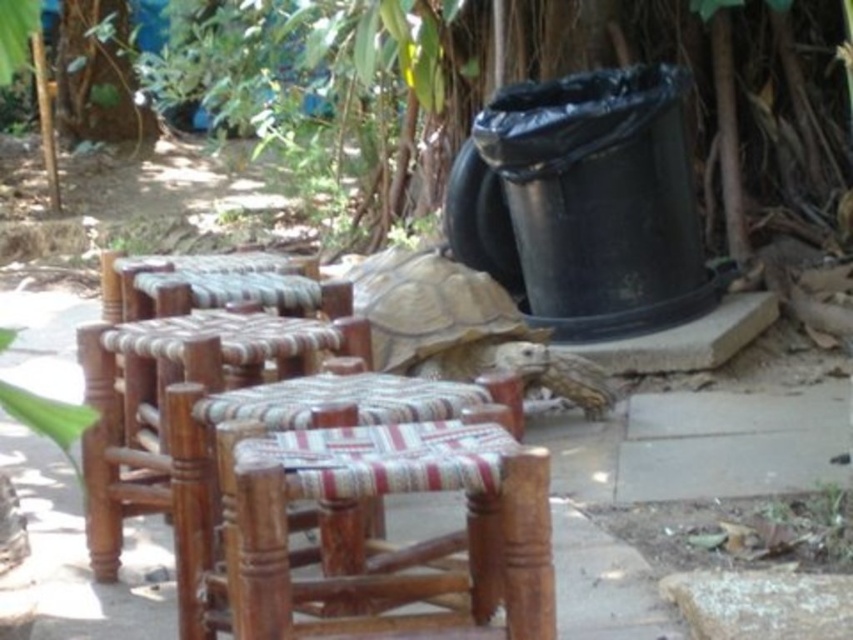
You are setting up a picnic area and need to place a small basket between the wooden stool at left and the brown textured shell at center. Based on their widths, which object should you place the basket closer to to ensure it fits comfortably?

The wooden stool at left is wider than the brown textured shell at center, so placing the basket closer to the brown textured shell at center would allow more space for the basket to fit comfortably.